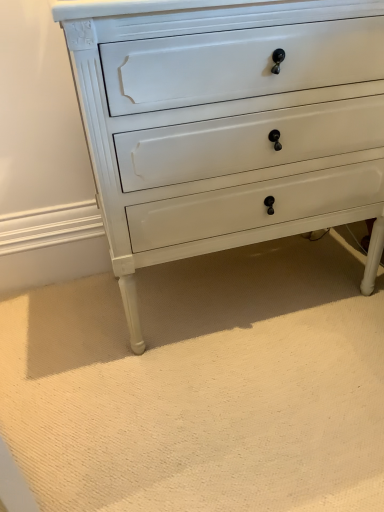
Question: Which direction should I rotate to look at white painted wood chest of drawers at center?

Choices:
 (A) left
 (B) right

Answer: (B)